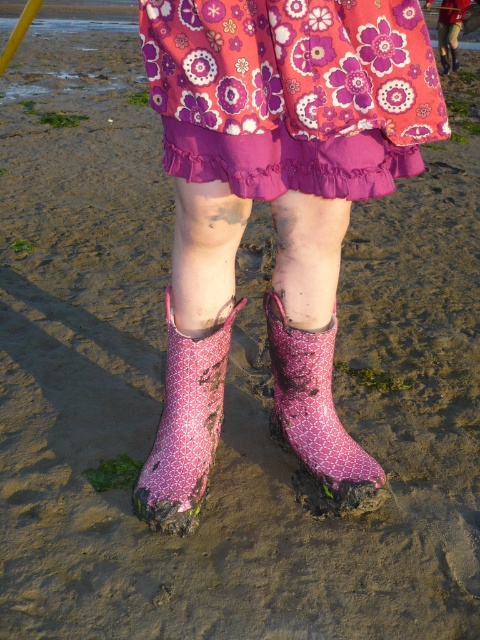
You are a fashion designer observing the outfit. Which item is positioned higher on the person, the pink floral fabric skirt at upper center or the pink rubber boot at lower center?

The pink floral fabric skirt at upper center is located above the pink rubber boot at lower center, so it is positioned higher on the person.

You are a fashion designer trying to create a pair of boots that match the vibrant pink dress with floral patterns. You have two options to choose from the image. Which boot option is taller between the pink fabric boot at lower center and the pink rubber boot at lower center?

The pink fabric boot at lower center is taller than the pink rubber boot at lower center according to the description.

You are a fashion designer observing the image. You notice the pink rubber boots at center and the pink fabric boot at lower center. Which boot is placed above the other?

The pink rubber boots at center is positioned over the pink fabric boot at lower center.